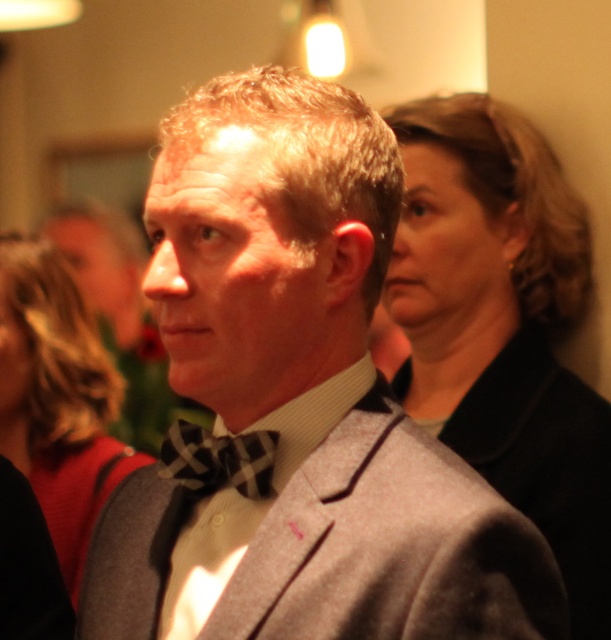
You are a photographer setting up for a group photo. You need to ensure that all subjects are visible. The gray wool suit at center and the smooth black jacket at upper right are in your frame. Which one is shorter and might need to be positioned closer to the camera to be seen clearly?

The gray wool suit at center is shorter than the smooth black jacket at upper right, so it might need to be positioned closer to the camera to ensure it is visible.